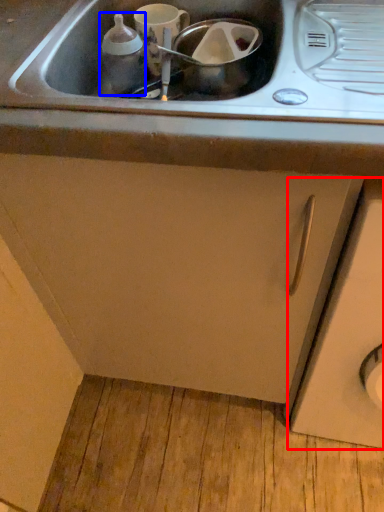
Question: Which object appears closest to the camera in this image, cabinetry (highlighted by a red box) or bottle (highlighted by a blue box)?

Choices:
 (A) cabinetry
 (B) bottle

Answer: (A)